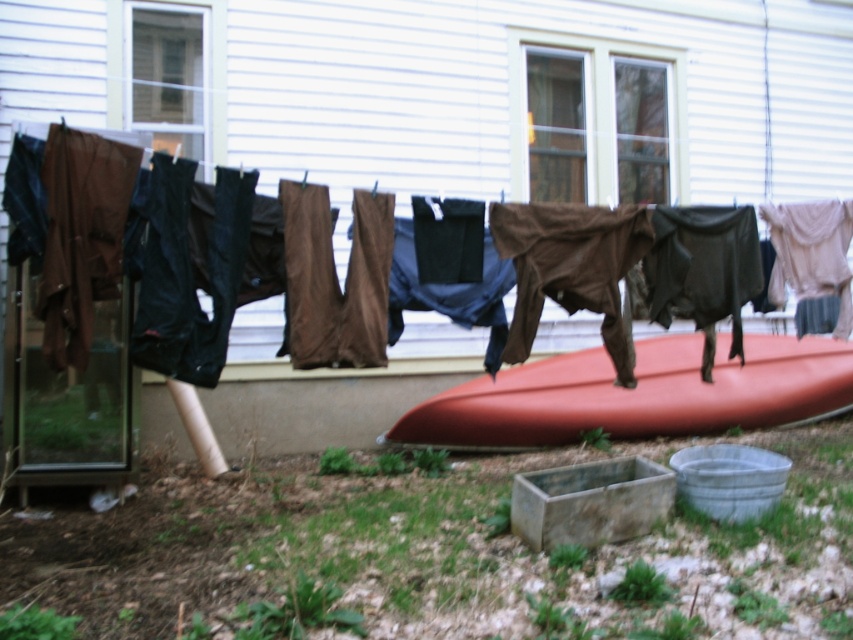
Question: Which of the following is the farthest from the observer?

Choices:
 (A) matte orange kayak at center
 (B) matte brown pants at center

Answer: (A)

Question: Which point appears farthest from the camera in this image?

Choices:
 (A) (697, 364)
 (B) (137, 189)

Answer: (A)

Question: Which of the following is the farthest from the observer?

Choices:
 (A) matte brown pants at center
 (B) matte orange kayak at center

Answer: (B)

Question: Is matte brown pants at center above matte orange kayak at center?

Choices:
 (A) no
 (B) yes

Answer: (B)

Question: Considering the relative positions of matte brown pants at center and matte orange kayak at center in the image provided, where is matte brown pants at center located with respect to matte orange kayak at center?

Choices:
 (A) below
 (B) above

Answer: (B)

Question: Does matte brown pants at center appear over matte orange kayak at center?

Choices:
 (A) no
 (B) yes

Answer: (B)